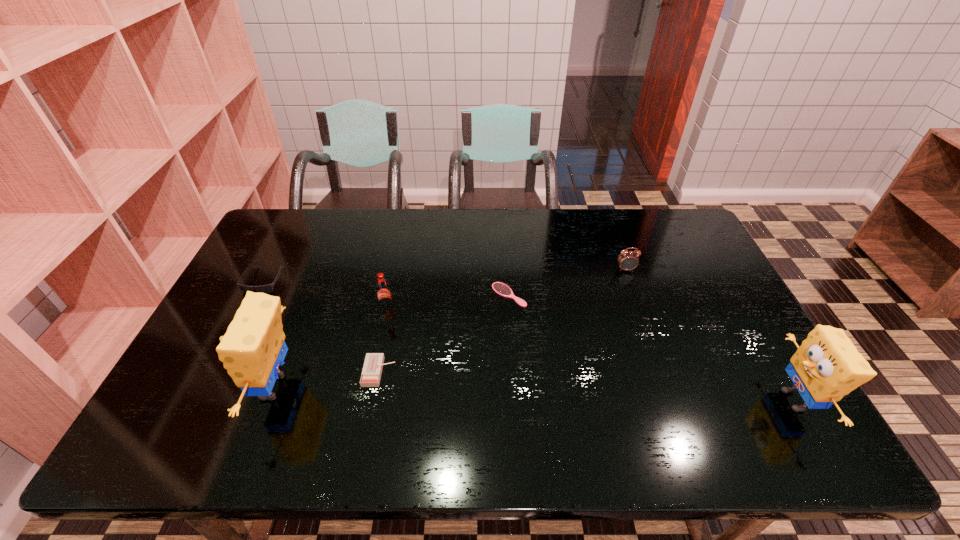
To ensure equal spacing by inserting another sponge among them, please point out a vacant spot for this new sponge. Please provide its 2D coordinates. Your answer should be formatted as a tuple, i.e. [(x, y)], where the tuple contains the x and y coordinates of a point satisfying the conditions above.

[(531, 394)]